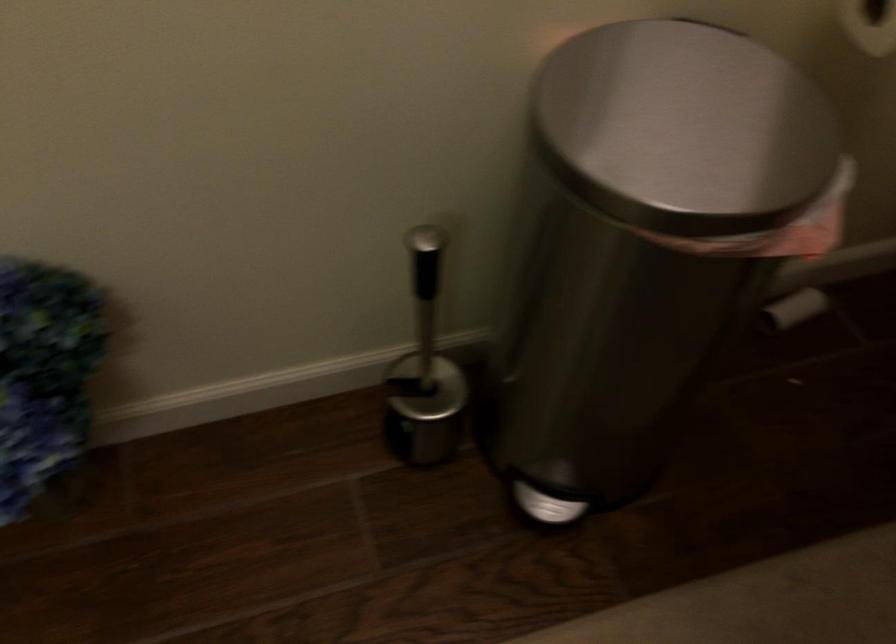
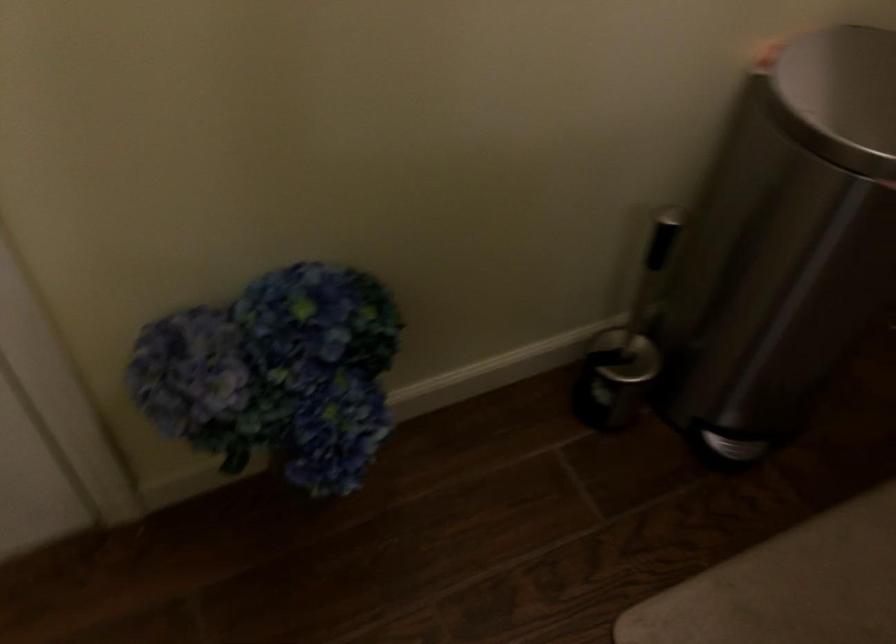
The images are taken continuously from a first-person perspective. In which direction are you moving?

The cameraman walked toward left, backward.